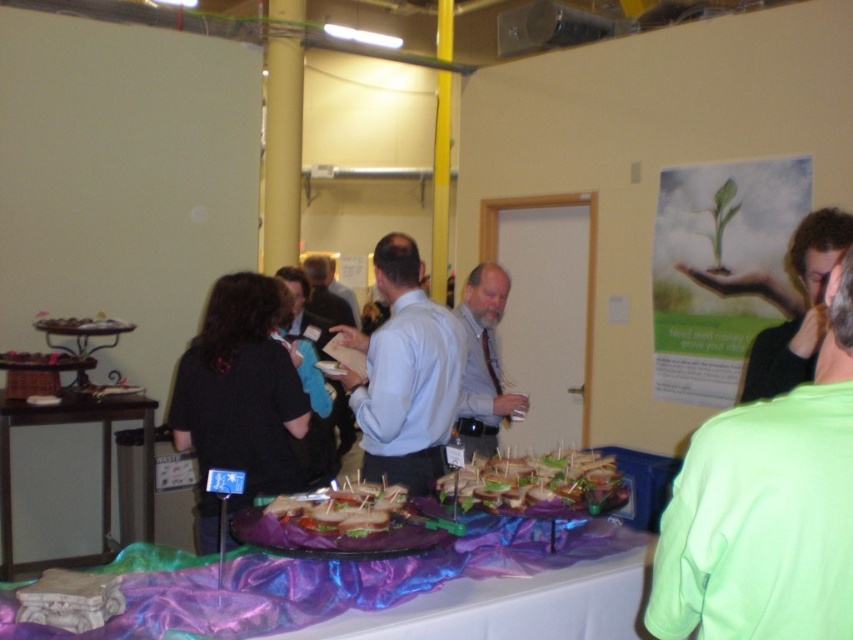
Question: Which of these objects is positioned closest to the purple satin table at lower center?

Choices:
 (A) black shirt at upper right
 (B) white glossy table at lower left
 (C) black fabric at left

Answer: (C)

Question: In this image, where is black shirt at upper right located relative to gray shirt at center?

Choices:
 (A) above
 (B) below

Answer: (A)

Question: Can you confirm if black fabric at left is smaller than matte brown bread at center?

Choices:
 (A) yes
 (B) no

Answer: (B)

Question: Is purple satin table at lower center to the left of black shirt at upper right from the viewer's perspective?

Choices:
 (A) no
 (B) yes

Answer: (B)

Question: Among these objects, which one is farthest from the camera?

Choices:
 (A) wooden door at center
 (B) gray shirt at center
 (C) purple satin table at lower center

Answer: (A)

Question: Among these points, which one is farthest from the camera?

Choices:
 (A) (367, 385)
 (B) (776, 593)
 (C) (526, 440)
 (D) (207, 492)

Answer: (C)